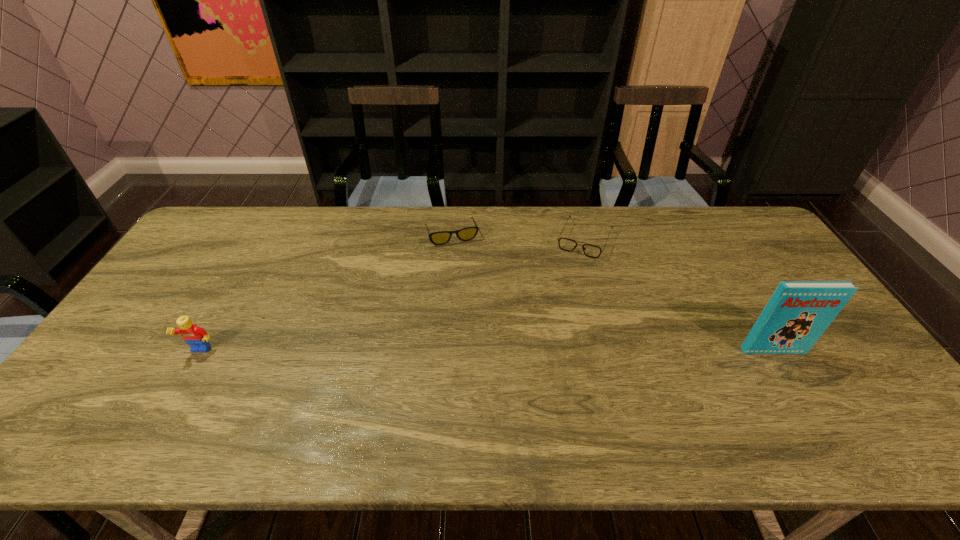
At what (x,y) coordinates should I click in order to perform the action: click on Lego. Please return your answer as a coordinate pair (x, y). Looking at the image, I should click on (196, 337).

This screenshot has height=540, width=960. In order to click on the leftmost object in this screenshot , I will do `click(196, 337)`.

At what (x,y) coordinates should I click in order to perform the action: click on book. Please return your answer as a coordinate pair (x, y). Looking at the image, I should click on (797, 314).

You are a GUI agent. You are given a task and a screenshot of the screen. Output one action in this format:
    pyautogui.click(x=<x>, y=<y>)
    Task: Click on the rightmost object
    This screenshot has width=960, height=540.
    Given the screenshot: What is the action you would take?
    pyautogui.click(x=797, y=314)

Image resolution: width=960 pixels, height=540 pixels. I want to click on the left sunglasses, so click(x=465, y=234).

Find the location of a particular element. Image resolution: width=960 pixels, height=540 pixels. the second object from right to left is located at coordinates (592, 251).

Find the location of a particular element. blank area located 0.050m on the face of the leftmost object is located at coordinates (186, 376).

The image size is (960, 540). Find the location of `free space located on the front cover of the rightmost object`. free space located on the front cover of the rightmost object is located at coordinates (787, 374).

Where is `vacant region located 0.050m on the front-facing side of the second object from left to right`? vacant region located 0.050m on the front-facing side of the second object from left to right is located at coordinates (461, 256).

Image resolution: width=960 pixels, height=540 pixels. What are the coordinates of `free space located on the front-facing side of the second object from left to right` in the screenshot? It's located at (471, 287).